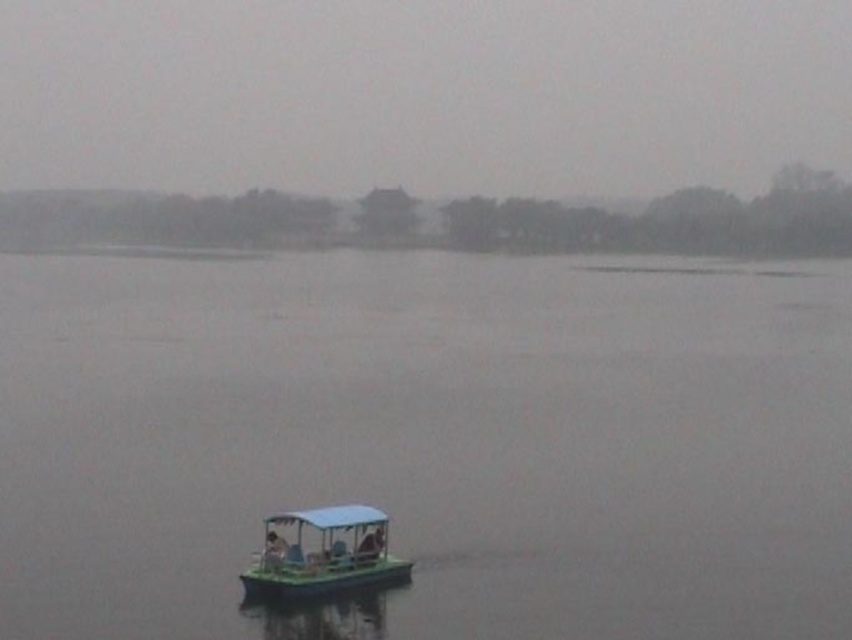
Consider the image. You are standing on the boat and looking at two points in the foggy water. The first point is at coordinates point (x=522, y=332) and the second is at point (x=269, y=556). Which point is closer to you?

Point (x=522, y=332) is further to the camera than point (x=269, y=556), so the second point is closer to you.

You are standing on a dock and see the green plastic boat at center in the foggy water scene. If the dock is at coordinate point 0.5, 0.5, is the boat located to the north or south of the dock?

The green plastic boat at center is located at coordinate point (430, 440). Since the dock is at (426, 320), the boat is to the east of the dock because its x coordinate is higher than the dock.